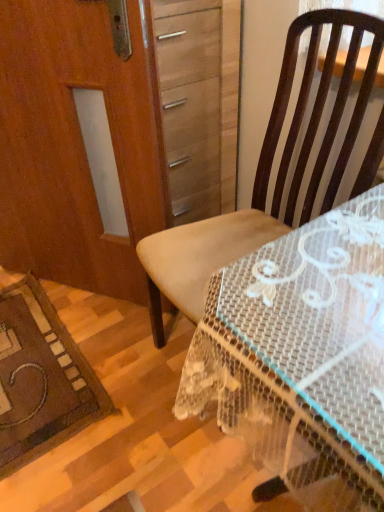
Question: Is brown fabric chair at center surrounded by clear plastic table at center?

Choices:
 (A) yes
 (B) no

Answer: (B)

Question: From the image's perspective, would you say clear plastic table at center is positioned over brown fabric chair at center?

Choices:
 (A) yes
 (B) no

Answer: (B)

Question: Could you tell me if clear plastic table at center is turned towards brown fabric chair at center?

Choices:
 (A) yes
 (B) no

Answer: (B)

Question: From a real-world perspective, is clear plastic table at center under brown fabric chair at center?

Choices:
 (A) no
 (B) yes

Answer: (B)

Question: Is clear plastic table at center to the left of brown fabric chair at center from the viewer's perspective?

Choices:
 (A) no
 (B) yes

Answer: (A)

Question: Considering their positions, is clear plastic table at center located in front of or behind brown fabric chair at center?

Choices:
 (A) front
 (B) behind

Answer: (A)

Question: Considering the positions of point (236, 374) and point (193, 301), is point (236, 374) closer or farther from the camera than point (193, 301)?

Choices:
 (A) closer
 (B) farther

Answer: (A)

Question: Based on their positions, is clear plastic table at center located to the left or right of brown fabric chair at center?

Choices:
 (A) right
 (B) left

Answer: (A)

Question: Is clear plastic table at center situated inside brown fabric chair at center or outside?

Choices:
 (A) outside
 (B) inside

Answer: (A)

Question: Based on their positions, is clear plastic table at center located to the left or right of wooden screen door at left?

Choices:
 (A) right
 (B) left

Answer: (A)

Question: Is clear plastic table at center wider or thinner than wooden screen door at left?

Choices:
 (A) wide
 (B) thin

Answer: (A)

Question: From the image's perspective, relative to wooden screen door at left, is clear plastic table at center above or below?

Choices:
 (A) above
 (B) below

Answer: (B)

Question: From their relative heights in the image, would you say clear plastic table at center is taller or shorter than wooden screen door at left?

Choices:
 (A) tall
 (B) short

Answer: (B)

Question: From a real-world perspective, is wooden screen door at left above or below clear plastic table at center?

Choices:
 (A) below
 (B) above

Answer: (B)

Question: Is wooden screen door at left spatially inside clear plastic table at center, or outside of it?

Choices:
 (A) outside
 (B) inside

Answer: (A)